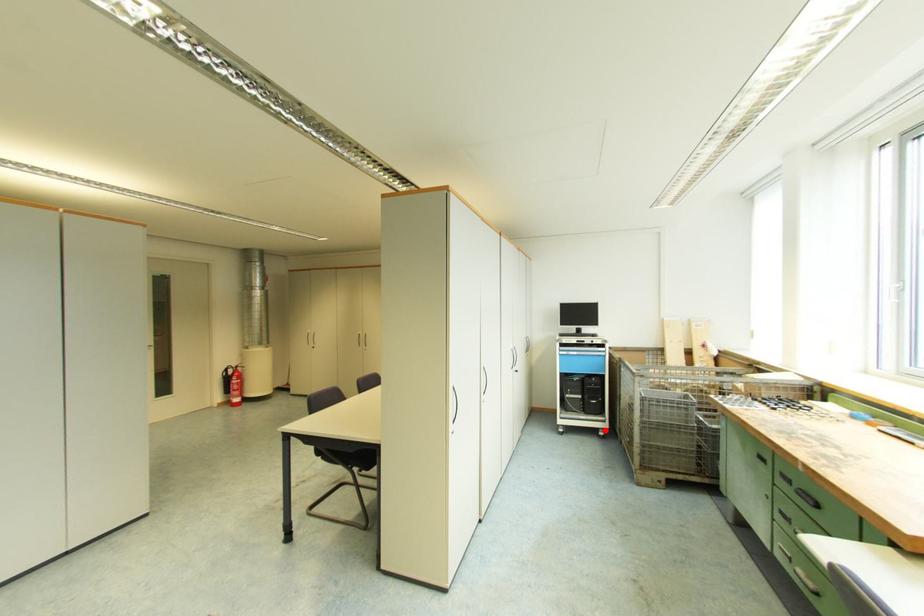
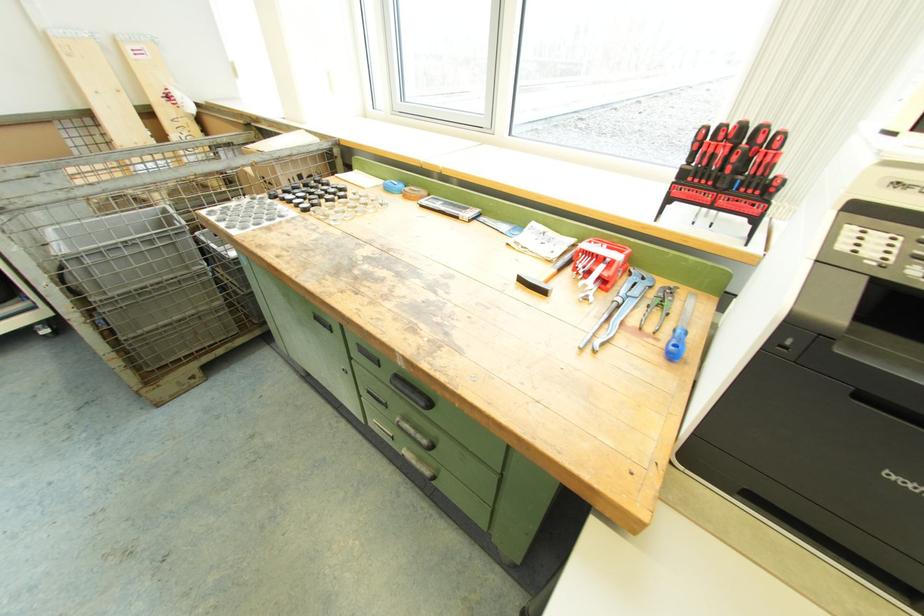
The point at the highlighted location is marked in the first image. Where is the corresponding point in the second image?

(43, 326)